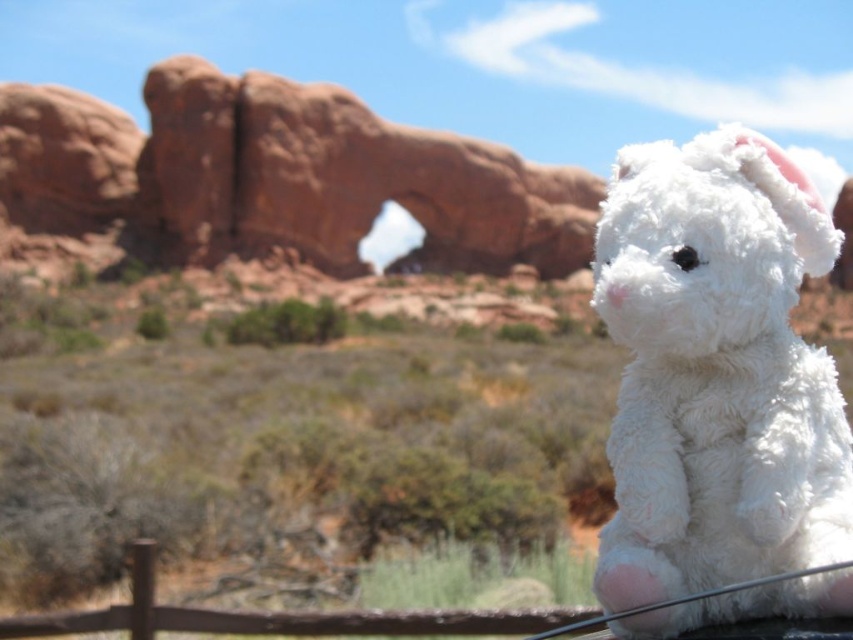
Is rustic sandstone arch at center further to the viewer compared to brown wooden fence at lower center?

Yes, rustic sandstone arch at center is further from the viewer.

Between point (239, 244) and point (50, 616), which one is positioned behind?

Point (239, 244)

Locate an element on the screen. rustic sandstone arch at center is located at coordinates pyautogui.click(x=280, y=176).

Who is lower down, white fluffy stuffed animal at right or rustic sandstone arch at center?

white fluffy stuffed animal at right is below.

Image resolution: width=853 pixels, height=640 pixels. Find the location of `white fluffy stuffed animal at right`. white fluffy stuffed animal at right is located at coordinates (717, 371).

This screenshot has width=853, height=640. In order to click on white fluffy stuffed animal at right in this screenshot , I will do `click(717, 371)`.

Is white fluffy stuffed animal at right bigger than brown wooden fence at lower center?

Actually, white fluffy stuffed animal at right might be smaller than brown wooden fence at lower center.

Is point (688, 611) in front of point (146, 554)?

Yes.

Locate an element on the screen. The height and width of the screenshot is (640, 853). white fluffy stuffed animal at right is located at coordinates (717, 371).

The image size is (853, 640). I want to click on white fluffy stuffed animal at right, so click(x=717, y=371).